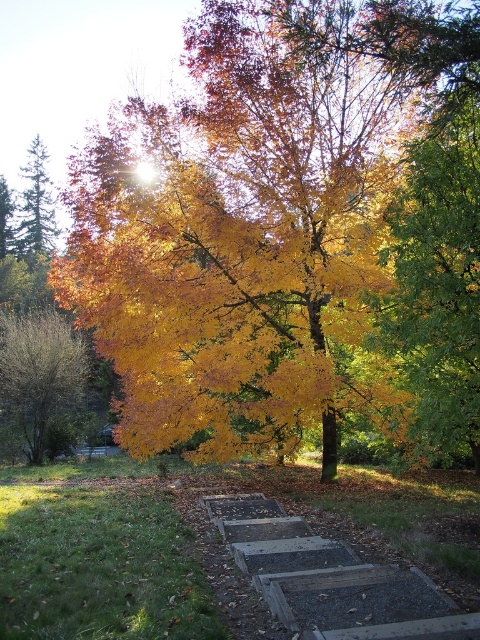
Question: From the image, what is the correct spatial relationship of concrete steps at center in relation to green matte evergreen tree at left?

Choices:
 (A) above
 (B) below

Answer: (B)

Question: Among these points, which one is farthest from the camera?

Choices:
 (A) (37, 410)
 (B) (49, 195)
 (C) (398, 627)

Answer: (B)

Question: Which point appears farthest from the camera in this image?

Choices:
 (A) (43, 177)
 (B) (272, 540)
 (C) (21, 429)

Answer: (A)

Question: Considering the relative positions of concrete steps at center and green matte evergreen tree at left in the image provided, where is concrete steps at center located with respect to green matte evergreen tree at left?

Choices:
 (A) left
 (B) right

Answer: (B)

Question: Which object is positioned farthest from the green matte evergreen tree at left?

Choices:
 (A) concrete steps at center
 (B) brown textured bush at left

Answer: (A)

Question: Is concrete steps at center to the left of brown textured bush at left from the viewer's perspective?

Choices:
 (A) no
 (B) yes

Answer: (A)